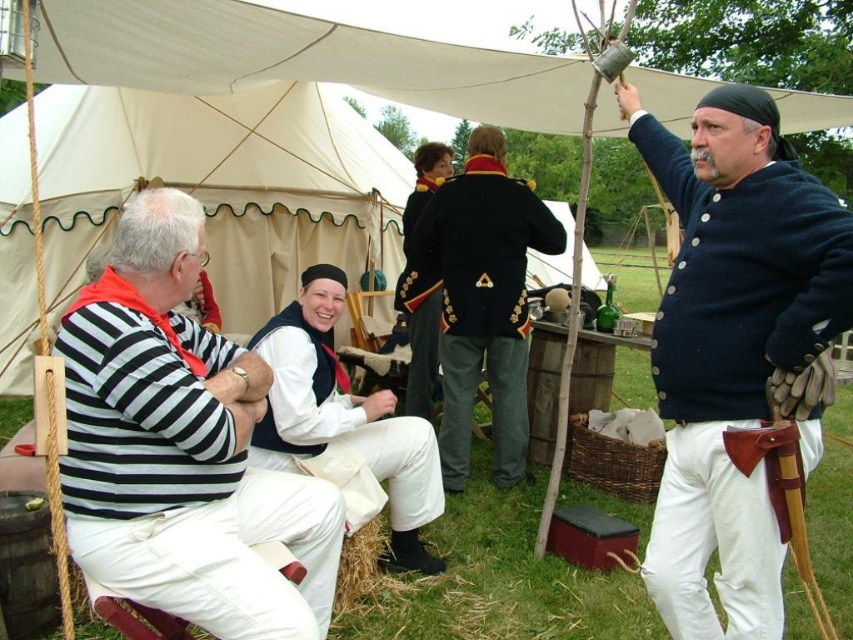
You are a photographer setting up a tripod to capture the two central figures in the scene. The striped cotton shirt at center and the shiny black coat at center are both in your frame. If you want to ensure both are fully visible without cropping either, which figure should you adjust your camera angle to prioritize based on their width?

The striped cotton shirt at center might be wider than shiny black coat at center, so you should prioritize adjusting the camera angle to accommodate the width of the striped cotton shirt at center to ensure both are fully visible.

From the picture: You are a photographer standing at the center of the tent. You want to take a photo of the navy blue fabric shirt at upper right and the white cotton vest at center. Can you fit both subjects into your camera frame if your camera has a maximum viewing angle that can capture objects within a 5 feet range from the center point?

The distance between the navy blue fabric shirt at upper right and the white cotton vest at center is 4.68 feet, which is within the 5 feet range. Therefore, both subjects can be captured in the same frame.

You are organizing a costume party and need to store the white cotton vest at center and the shiny black coat at center in a closet. Based on the image, which item will require more storage space?

The shiny black coat at center requires more storage space because it occupies more space than the white cotton vest at center.